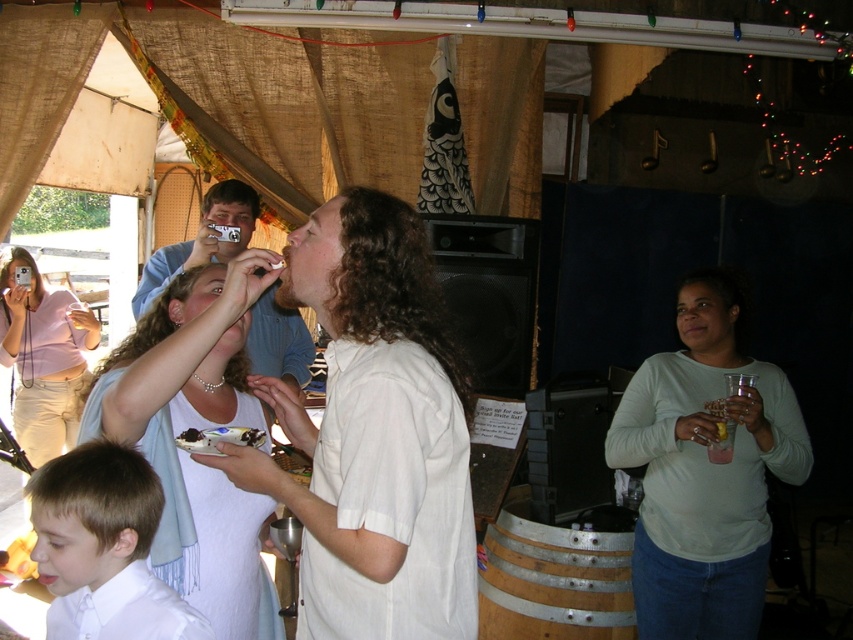
Between light green long-sleeve shirt at center-right and matte pink shirt at upper left, which one appears on the left side from the viewer's perspective?

From the viewer's perspective, matte pink shirt at upper left appears more on the left side.

Who is more forward, (708, 467) or (64, 292)?

Point (708, 467) is in front.

Where is `light green long-sleeve shirt at center-right`? The image size is (853, 640). light green long-sleeve shirt at center-right is located at coordinates click(x=705, y=468).

Describe the element at coordinates (103, 547) in the screenshot. This screenshot has width=853, height=640. I see `white smooth shirt at lower left` at that location.

Is white smooth shirt at lower left bigger than wooden barrel at lower center?

Actually, white smooth shirt at lower left might be smaller than wooden barrel at lower center.

This screenshot has width=853, height=640. Find the location of `white smooth shirt at lower left`. white smooth shirt at lower left is located at coordinates (103, 547).

I want to click on white smooth shirt at lower left, so click(103, 547).

In the scene shown: Which is more to the left, light green long-sleeve shirt at center-right or wooden barrel at lower center?

From the viewer's perspective, wooden barrel at lower center appears more on the left side.

Who is shorter, light green long-sleeve shirt at center-right or wooden barrel at lower center?

wooden barrel at lower center

Does point (711, 593) come behind point (625, 588)?

No.

The height and width of the screenshot is (640, 853). I want to click on light green long-sleeve shirt at center-right, so click(x=705, y=468).